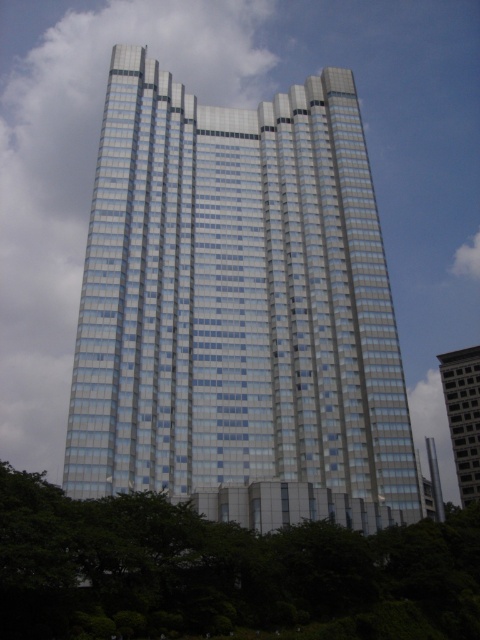
You are a city planner evaluating the skyline. Given the glassy steel tower at center and the glassy reflective building at right, which one would cast a longer shadow during midday?

The glassy steel tower at center has a greater height compared to the glassy reflective building at right, so it would cast a longer shadow during midday.

You are standing in a park and see the green leafy tree at lower center and the glassy reflective building at right. Which object has a narrower width?

The green leafy tree at lower center is thinner than the glassy reflective building at right, so the green leafy tree at lower center has a narrower width.

You are a drone operator who needs to fly a drone between the glassy steel tower at center and the glassy reflective building at right. The drone has a maximum flight distance of 80 meters. Can the drone safely complete the flight between them without exceeding its range?

The glassy steel tower at center is 82.34 meters away from the glassy reflective building at right. Since the drone can only fly up to 80 meters, it cannot safely complete the flight between them without exceeding its range.